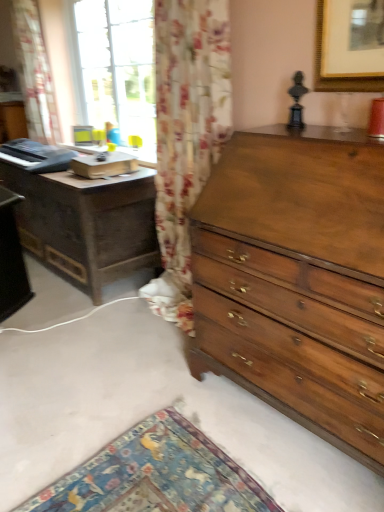
Question: Does point (29, 76) appear closer or farther from the camera than point (41, 248)?

Choices:
 (A) closer
 (B) farther

Answer: (B)

Question: Is floral fabric curtain at left taller or shorter than dark wood nightstand at left?

Choices:
 (A) short
 (B) tall

Answer: (B)

Question: Based on their relative distances, which object is nearer to the shiny brown wood chest of drawers at right?

Choices:
 (A) floral fabric curtain at left
 (B) dark wood nightstand at left

Answer: (B)

Question: Considering the real-world distances, which object is closest to the floral fabric curtain at left?

Choices:
 (A) dark wood nightstand at left
 (B) shiny brown wood chest of drawers at right

Answer: (A)